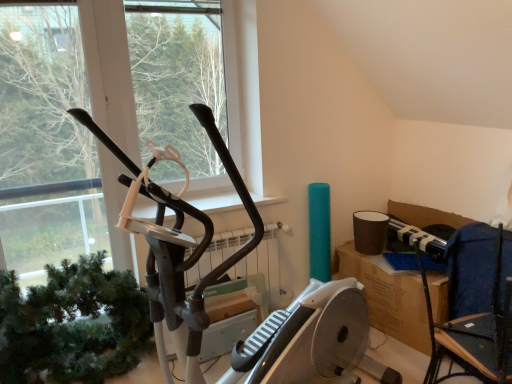
Question: Does black matte elliptical machine at center turn towards dark blue fabric chair at right?

Choices:
 (A) yes
 (B) no

Answer: (A)

Question: Is black matte elliptical machine at center directly adjacent to dark blue fabric chair at right?

Choices:
 (A) yes
 (B) no

Answer: (B)

Question: Is black matte elliptical machine at center not near dark blue fabric chair at right?

Choices:
 (A) yes
 (B) no

Answer: (A)

Question: Is black matte elliptical machine at center thinner than dark blue fabric chair at right?

Choices:
 (A) no
 (B) yes

Answer: (B)

Question: Considering the relative sizes of black matte elliptical machine at center and dark blue fabric chair at right in the image provided, is black matte elliptical machine at center taller than dark blue fabric chair at right?

Choices:
 (A) no
 (B) yes

Answer: (B)

Question: Looking at their shapes, would you say green matte plant at left is wider or thinner than dark blue fabric chair at right?

Choices:
 (A) wide
 (B) thin

Answer: (A)

Question: Is point (60, 269) closer or farther from the camera than point (458, 352)?

Choices:
 (A) farther
 (B) closer

Answer: (A)

Question: In terms of size, does green matte plant at left appear bigger or smaller than dark blue fabric chair at right?

Choices:
 (A) big
 (B) small

Answer: (A)

Question: In terms of height, does green matte plant at left look taller or shorter compared to dark blue fabric chair at right?

Choices:
 (A) tall
 (B) short

Answer: (B)

Question: From a real-world perspective, is black matte elliptical machine at center above or below black matte stationary bicycle at left?

Choices:
 (A) above
 (B) below

Answer: (A)

Question: In terms of size, does black matte elliptical machine at center appear bigger or smaller than black matte stationary bicycle at left?

Choices:
 (A) small
 (B) big

Answer: (A)

Question: Is point (182, 66) closer or farther from the camera than point (246, 251)?

Choices:
 (A) farther
 (B) closer

Answer: (A)

Question: Considering the positions of black matte elliptical machine at center and black matte stationary bicycle at left in the image, is black matte elliptical machine at center taller or shorter than black matte stationary bicycle at left?

Choices:
 (A) short
 (B) tall

Answer: (A)

Question: Would you say dark blue fabric chair at right is to the left or to the right of black matte elliptical machine at center in the picture?

Choices:
 (A) right
 (B) left

Answer: (A)

Question: Considering their positions, is dark blue fabric chair at right located in front of or behind black matte elliptical machine at center?

Choices:
 (A) behind
 (B) front

Answer: (B)